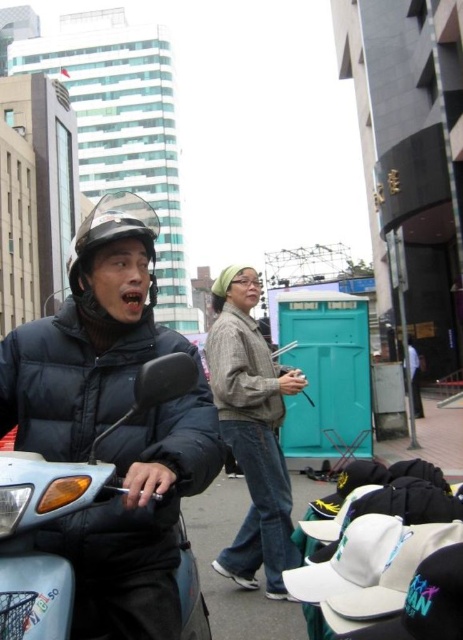
Question: Does light blue plastic motorcycle at left appear over matte black helmet at center?

Choices:
 (A) no
 (B) yes

Answer: (A)

Question: Is knitted beige sweater at center to the left of matte black helmet at center from the viewer's perspective?

Choices:
 (A) yes
 (B) no

Answer: (B)

Question: Which of the following is the closest to the observer?

Choices:
 (A) light blue plastic motorcycle at left
 (B) matte black helmet at center
 (C) white matte baseball hat at lower center
 (D) knitted beige sweater at center

Answer: (A)

Question: Which point is farther from the camera taking this photo?

Choices:
 (A) (414, 561)
 (B) (276, 461)

Answer: (B)

Question: Which of the following is the closest to the observer?

Choices:
 (A) (250, 404)
 (B) (22, 560)

Answer: (B)

Question: Is light blue plastic motorcycle at left closer to the viewer compared to matte black helmet at center?

Choices:
 (A) yes
 (B) no

Answer: (A)